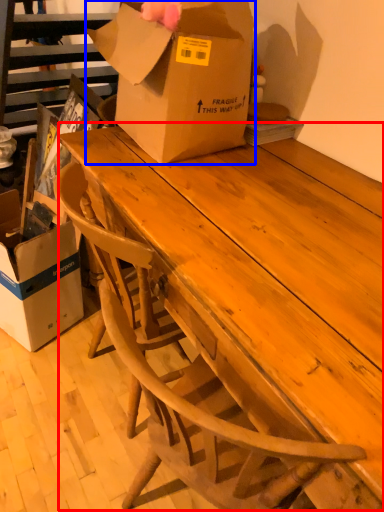
Question: Which object is closer to the camera taking this photo, table (highlighted by a red box) or box (highlighted by a blue box)?

Choices:
 (A) table
 (B) box

Answer: (A)